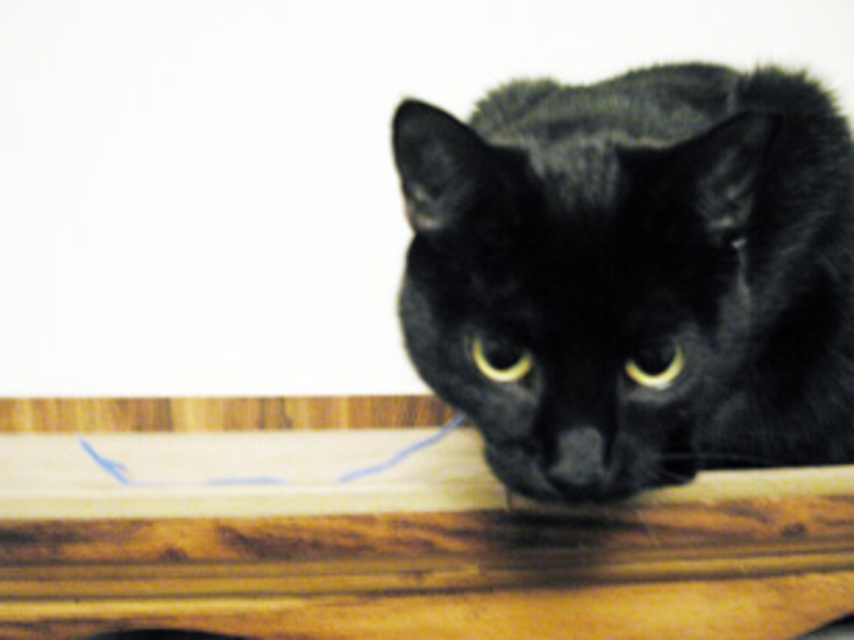
You are standing in front of the wooden surface shown in the scene. There is a point marked at coordinates (635, 275). What object is located at that point?

The point at coordinates (635, 275) indicates the location of the black fur cat at center.

You are a photographer setting up a shoot with a black fur cat at center and a wooden table at center. You want to ensure the cat is visible in front of the table. Based on the scene, is the cat positioned correctly?

Yes, the black fur cat at center is in front of the wooden table at center, so it is positioned correctly to be visible in front of the table.

You are an AI analyzing the image. Where is the black fur cat at center located in terms of its 2D coordinates?

The black fur cat at center is located at the 2D coordinates point (x=635, y=275).